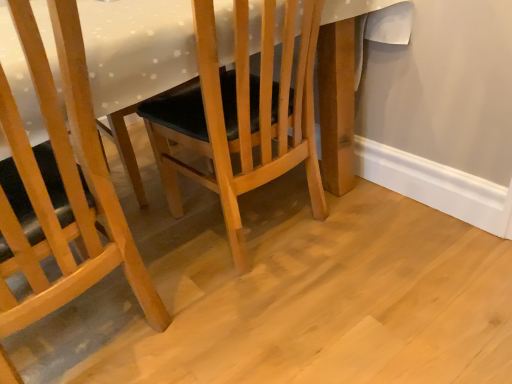
Describe the element at coordinates (138, 51) in the screenshot. I see `white glossy table at center` at that location.

The image size is (512, 384). What do you see at coordinates (243, 115) in the screenshot?
I see `wooden chair at center, which is counted as the 2th chair, starting from the left` at bounding box center [243, 115].

This screenshot has height=384, width=512. Identify the location of white glossy table at center. (138, 51).

Can you confirm if wooden chair at center, which is the first chair from right to left, is wider than matte wood chair at center, the second chair in the right-to-left sequence?

Indeed, wooden chair at center, which is the first chair from right to left, has a greater width compared to matte wood chair at center, the second chair in the right-to-left sequence.

Would you say matte wood chair at center, the second chair in the right-to-left sequence, is part of wooden chair at center, which is counted as the 2th chair, starting from the left,'s contents?

That's incorrect, matte wood chair at center, the second chair in the right-to-left sequence, is not inside wooden chair at center, which is counted as the 2th chair, starting from the left.

Considering the sizes of wooden chair at center, which is the first chair from right to left, and matte wood chair at center, marked as the first chair in a left-to-right arrangement, in the image, is wooden chair at center, which is the first chair from right to left, taller or shorter than matte wood chair at center, marked as the first chair in a left-to-right arrangement,?

Considering their sizes, wooden chair at center, which is the first chair from right to left, has less height than matte wood chair at center, marked as the first chair in a left-to-right arrangement.

In terms of width, does matte wood chair at center, marked as the first chair in a left-to-right arrangement, look wider or thinner when compared to wooden chair at center, which is the first chair from right to left?

Clearly, matte wood chair at center, marked as the first chair in a left-to-right arrangement, has less width compared to wooden chair at center, which is the first chair from right to left.

In the image, is matte wood chair at center, the second chair in the right-to-left sequence, positioned in front of or behind wooden chair at center, which is the first chair from right to left?

In the image, matte wood chair at center, the second chair in the right-to-left sequence, appears in front of wooden chair at center, which is the first chair from right to left.

From the image's perspective, is matte wood chair at center, the second chair in the right-to-left sequence, located above wooden chair at center, which is counted as the 2th chair, starting from the left?

No, from the image's perspective, matte wood chair at center, the second chair in the right-to-left sequence, is not over wooden chair at center, which is counted as the 2th chair, starting from the left.

What's the angular difference between matte wood chair at center, marked as the first chair in a left-to-right arrangement, and wooden chair at center, which is the first chair from right to left,'s facing directions?

9.11e-05 degrees separate the facing orientations of matte wood chair at center, marked as the first chair in a left-to-right arrangement, and wooden chair at center, which is the first chair from right to left.

In the scene shown: Which of these two, white glossy table at center or matte wood chair at center, marked as the first chair in a left-to-right arrangement, stands taller?

With more height is matte wood chair at center, marked as the first chair in a left-to-right arrangement.

From a real-world perspective, is white glossy table at center physically above matte wood chair at center, the second chair in the right-to-left sequence?

Actually, white glossy table at center is physically below matte wood chair at center, the second chair in the right-to-left sequence, in the real world.

Is white glossy table at center bigger than matte wood chair at center, marked as the first chair in a left-to-right arrangement?

Yes, white glossy table at center is bigger than matte wood chair at center, marked as the first chair in a left-to-right arrangement.

From a real-world perspective, is matte wood chair at center, marked as the first chair in a left-to-right arrangement, located higher than white glossy table at center?

Yes, from a real-world perspective, matte wood chair at center, marked as the first chair in a left-to-right arrangement, is over white glossy table at center

Which of these two, matte wood chair at center, marked as the first chair in a left-to-right arrangement, or white glossy table at center, stands taller?

matte wood chair at center, marked as the first chair in a left-to-right arrangement.

This screenshot has width=512, height=384. I want to click on table directly beneath the matte wood chair at center, marked as the first chair in a left-to-right arrangement (from a real-world perspective), so click(138, 51).

Does point (131, 260) come in front of point (230, 19)?

No, it is behind (230, 19).

From a real-world perspective, is wooden chair at center, which is the first chair from right to left, positioned over white glossy table at center based on gravity?

Yes, from a real-world perspective, wooden chair at center, which is the first chair from right to left, is on top of white glossy table at center.

How many degrees apart are the facing directions of wooden chair at center, which is counted as the 2th chair, starting from the left, and white glossy table at center?

There is a 90-degree angle between the facing directions of wooden chair at center, which is counted as the 2th chair, starting from the left, and white glossy table at center.

This screenshot has height=384, width=512. In order to click on table that is above the wooden chair at center, which is counted as the 2th chair, starting from the left (from the image's perspective) in this screenshot , I will do `click(138, 51)`.

From the image's perspective, is wooden chair at center, which is counted as the 2th chair, starting from the left, located beneath white glossy table at center?

Indeed, from the image's perspective, wooden chair at center, which is counted as the 2th chair, starting from the left, is shown beneath white glossy table at center.

From the image's perspective, between white glossy table at center and wooden chair at center, which is the first chair from right to left, who is located below?

From the image's view, wooden chair at center, which is the first chair from right to left, is below.

Does white glossy table at center appear on the left side of wooden chair at center, which is the first chair from right to left?

Yes.

Considering the relative sizes of white glossy table at center and wooden chair at center, which is the first chair from right to left, in the image provided, is white glossy table at center wider than wooden chair at center, which is the first chair from right to left,?

Indeed, white glossy table at center has a greater width compared to wooden chair at center, which is the first chair from right to left.

Considering the relative sizes of white glossy table at center and wooden chair at center, which is counted as the 2th chair, starting from the left, in the image provided, is white glossy table at center smaller than wooden chair at center, which is counted as the 2th chair, starting from the left,?

No, white glossy table at center is not smaller than wooden chair at center, which is counted as the 2th chair, starting from the left.

Find the location of `chair on the right of matte wood chair at center, marked as the first chair in a left-to-right arrangement`. chair on the right of matte wood chair at center, marked as the first chair in a left-to-right arrangement is located at coordinates pos(243,115).

At what (x,y) coordinates should I click in order to perform the action: click on chair above the wooden chair at center, which is the first chair from right to left (from a real-world perspective). Please return your answer as a coordinate pair (x, y). Looking at the image, I should click on (64, 186).

Based on their spatial positions, is wooden chair at center, which is counted as the 2th chair, starting from the left, or matte wood chair at center, marked as the first chair in a left-to-right arrangement, closer to white glossy table at center?

matte wood chair at center, marked as the first chair in a left-to-right arrangement, is closer to white glossy table at center.

Looking at this image, considering their positions, is white glossy table at center positioned closer to wooden chair at center, which is counted as the 2th chair, starting from the left, than matte wood chair at center, the second chair in the right-to-left sequence?

Based on the image, white glossy table at center appears to be nearer to wooden chair at center, which is counted as the 2th chair, starting from the left.

From the image, which object appears to be nearer to matte wood chair at center, marked as the first chair in a left-to-right arrangement, wooden chair at center, which is counted as the 2th chair, starting from the left, or white glossy table at center?

white glossy table at center is closer to matte wood chair at center, marked as the first chair in a left-to-right arrangement.

Considering their positions, is white glossy table at center positioned further to matte wood chair at center, the second chair in the right-to-left sequence, than wooden chair at center, which is the first chair from right to left?

Among the two, wooden chair at center, which is the first chair from right to left, is located further to matte wood chair at center, the second chair in the right-to-left sequence.

Looking at the image, which one is located further to white glossy table at center, matte wood chair at center, the second chair in the right-to-left sequence, or wooden chair at center, which is counted as the 2th chair, starting from the left?

wooden chair at center, which is counted as the 2th chair, starting from the left, is further to white glossy table at center.

From the image, which object appears to be nearer to wooden chair at center, which is the first chair from right to left, matte wood chair at center, marked as the first chair in a left-to-right arrangement, or white glossy table at center?

Among the two, white glossy table at center is located nearer to wooden chair at center, which is the first chair from right to left.

The image size is (512, 384). I want to click on table between matte wood chair at center, marked as the first chair in a left-to-right arrangement, and wooden chair at center, which is counted as the 2th chair, starting from the left, from left to right, so click(138, 51).